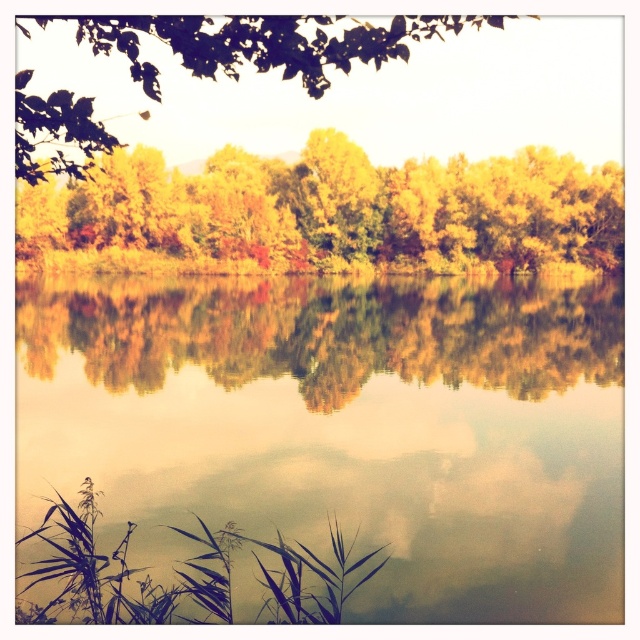
Question: Which of the following is the farthest from the observer?

Choices:
 (A) golden reflective water at center
 (B) smooth reflective water at center
 (C) green leafy tree at upper center
 (D) yellow-green leaves at center

Answer: (D)

Question: Does yellow-green leaves at center have a lesser width compared to golden reflective water at center?

Choices:
 (A) no
 (B) yes

Answer: (A)

Question: Which of these objects is positioned closest to the smooth reflective water at center?

Choices:
 (A) green leafy tree at upper center
 (B) yellow-green leaves at center

Answer: (A)

Question: Which point appears closest to the camera in this image?

Choices:
 (A) (378, 348)
 (B) (358, 168)
 (C) (600, 480)

Answer: (C)

Question: In this image, where is smooth reflective water at center located relative to golden reflective water at center?

Choices:
 (A) left
 (B) right

Answer: (B)

Question: Does smooth reflective water at center come behind golden reflective water at center?

Choices:
 (A) no
 (B) yes

Answer: (A)